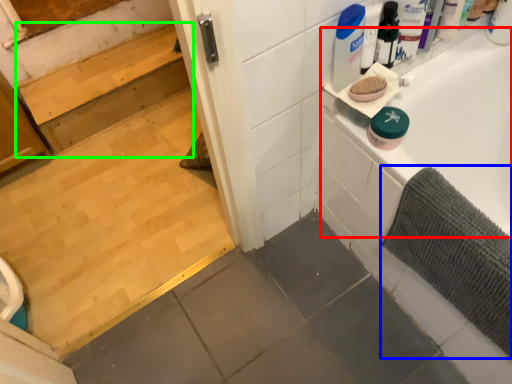
Question: Considering the real-world distances, which object is farthest from bathtub (highlighted by a red box)? bath mat (highlighted by a blue box) or stair (highlighted by a green box)?

Choices:
 (A) bath mat
 (B) stair

Answer: (B)